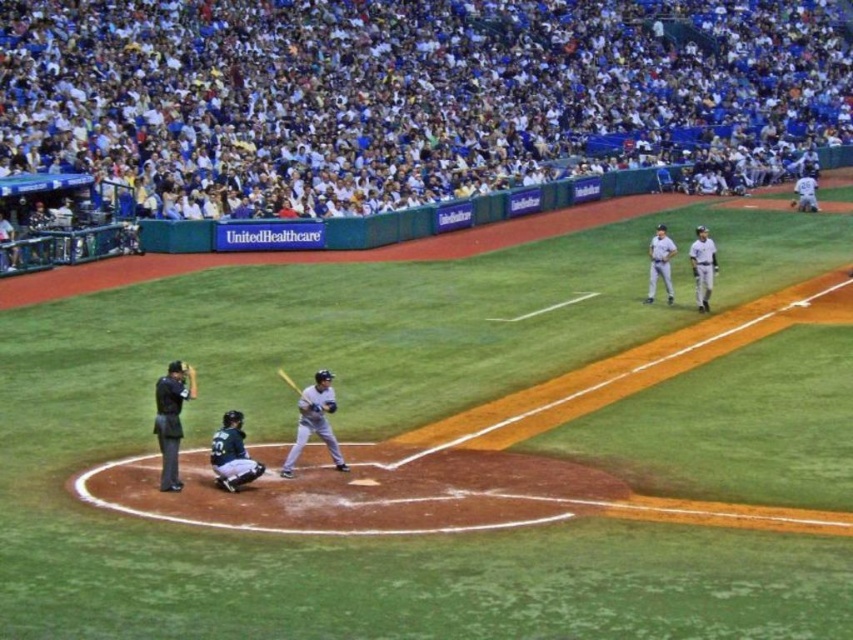
You are a photographer trying to capture the crowd in the background of the baseball game. The crowd is described as white fabric crowd at upper center. Where exactly should you position your camera to focus on this crowd?

The white fabric crowd at upper center is located at point 0.144 on the x axis and 0.483 on the y axis, so you should position your camera to focus on the coordinates x 0.144 and y 0.483 to capture the white fabric crowd at upper center.

You are a spectator at the baseball game and want to take a photo of both the gray matte uniform at center and the wooden baseball bat at center. Which object should you point your camera towards first if you want to capture them in the correct left to right order as seen from your seat?

You should first point your camera towards the wooden baseball bat at center because the gray matte uniform at center is to the right of it, so capturing the bat first ensures the correct left to right order.